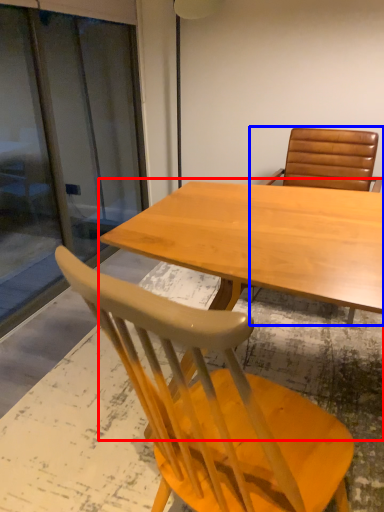
Question: Which object is further to the camera taking this photo, table (highlighted by a red box) or chair (highlighted by a blue box)?

Choices:
 (A) table
 (B) chair

Answer: (B)